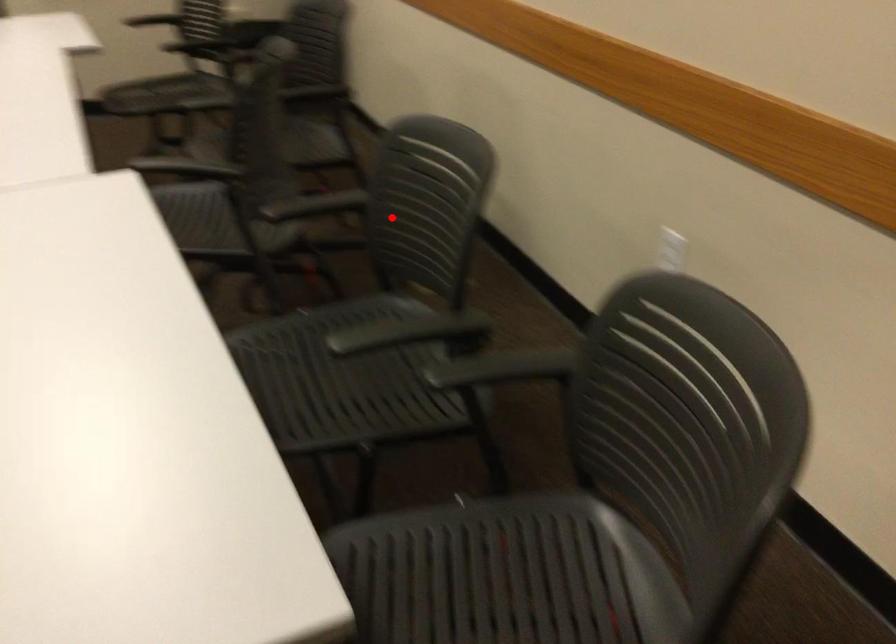
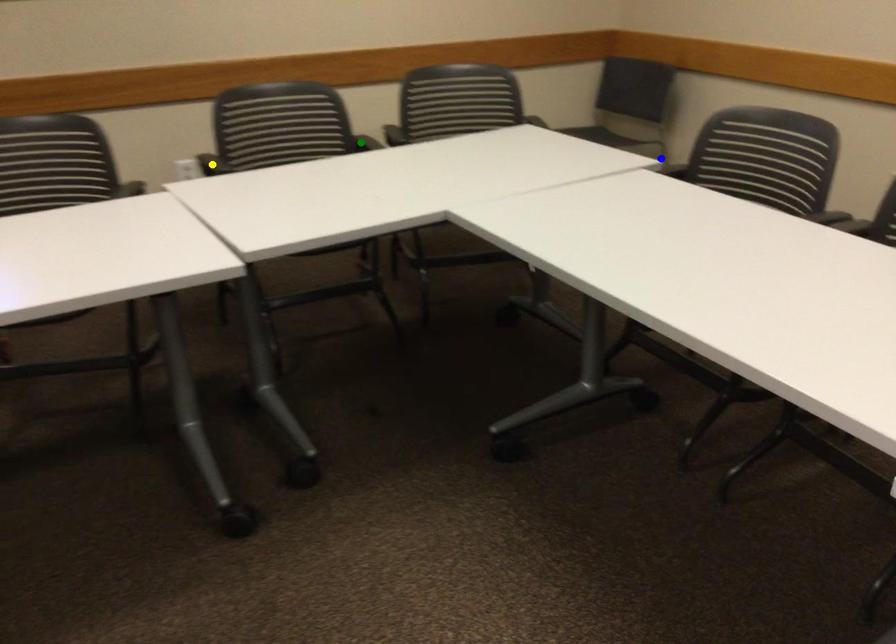
Question: I am providing you with two images of the same scene from different viewpoints. A red point is marked on the first image. You are given multiple points on the second image. Which point in image 2 is actually the same real-world point as the red point in image 1?

Choices:
 (A) green point
 (B) blue point
 (C) yellow point

Answer: (C)